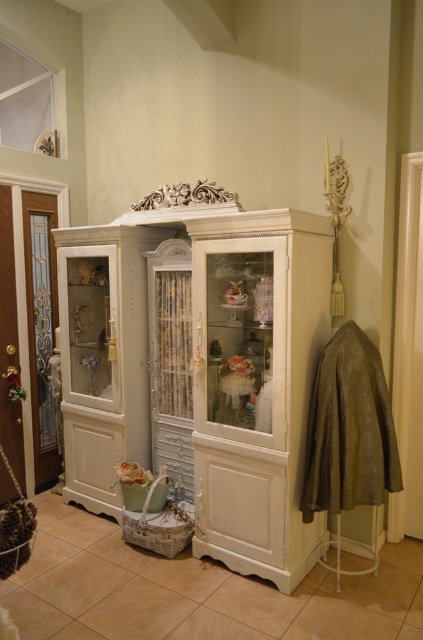
Question: Which object is farther from the camera taking this photo?

Choices:
 (A) white glossy cabinet at center
 (B) translucent glass door at left

Answer: (B)

Question: Where is white glossy cabinet at center located in relation to translucent glass door at left in the image?

Choices:
 (A) below
 (B) above

Answer: (A)

Question: Considering the relative positions of white glossy cabinet at center and translucent glass door at left in the image provided, where is white glossy cabinet at center located with respect to translucent glass door at left?

Choices:
 (A) below
 (B) above

Answer: (A)

Question: Does white glossy cabinet at center have a smaller size compared to translucent glass door at left?

Choices:
 (A) no
 (B) yes

Answer: (A)

Question: Which point is closer to the camera?

Choices:
 (A) (30, 285)
 (B) (233, 502)

Answer: (B)